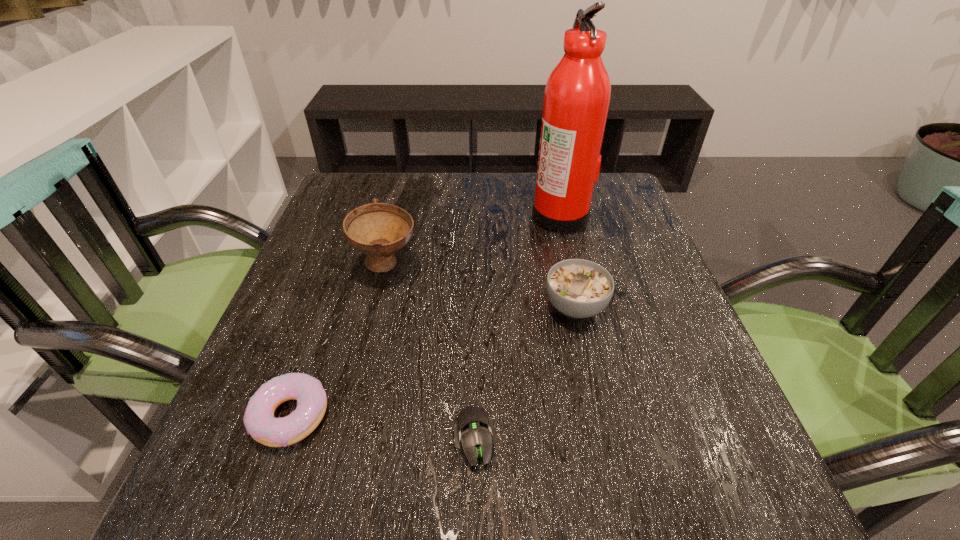
The width and height of the screenshot is (960, 540). I want to click on fire extinguisher present at the right edge, so click(x=578, y=91).

Locate an element on the screen. soup bowl present at the right edge is located at coordinates (578, 288).

Where is `object at the far right corner`? The image size is (960, 540). object at the far right corner is located at coordinates (578, 91).

Identify the location of blank space at the far edge of the desktop. The width and height of the screenshot is (960, 540). (483, 174).

In the image, there is a desktop. At what (x,y) coordinates should I click in order to perform the action: click on vacant space at the near edge. Please return your answer as a coordinate pair (x, y). This screenshot has width=960, height=540. Looking at the image, I should click on (439, 483).

Find the location of `vacant area at the left edge`. vacant area at the left edge is located at coordinates (301, 289).

At what (x,y) coordinates should I click in order to perform the action: click on free space at the right edge of the desktop. Please return your answer as a coordinate pair (x, y). Image resolution: width=960 pixels, height=540 pixels. Looking at the image, I should click on (631, 388).

Where is `vacant space at the far left corner`? This screenshot has height=540, width=960. vacant space at the far left corner is located at coordinates (367, 173).

In the image, there is a desktop. Where is `vacant space at the far right corner`? This screenshot has height=540, width=960. vacant space at the far right corner is located at coordinates (632, 202).

At what (x,y) coordinates should I click in order to perform the action: click on vacant region between the computer mouse and the shorter soup bowl. Please return your answer as a coordinate pair (x, y). The image size is (960, 540). Looking at the image, I should click on (525, 373).